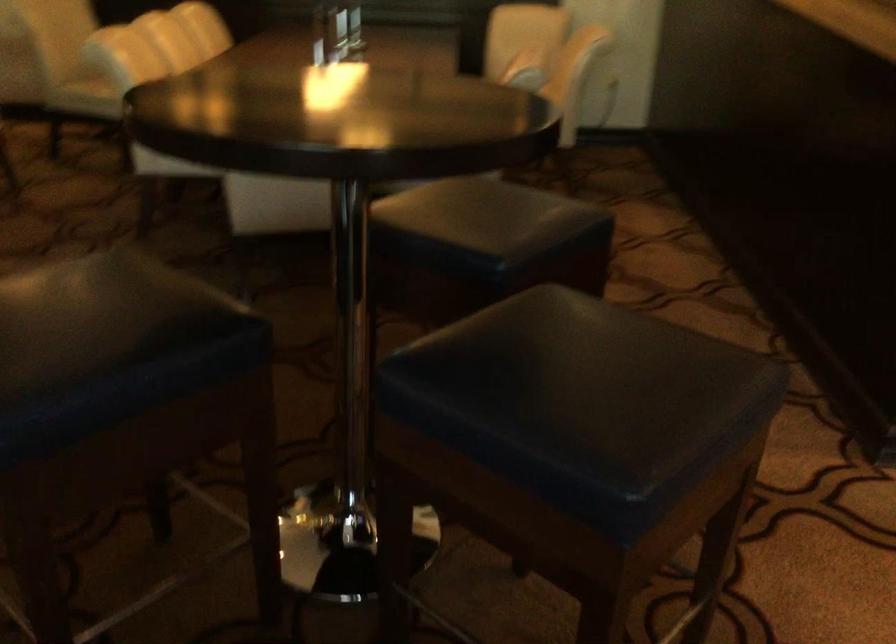
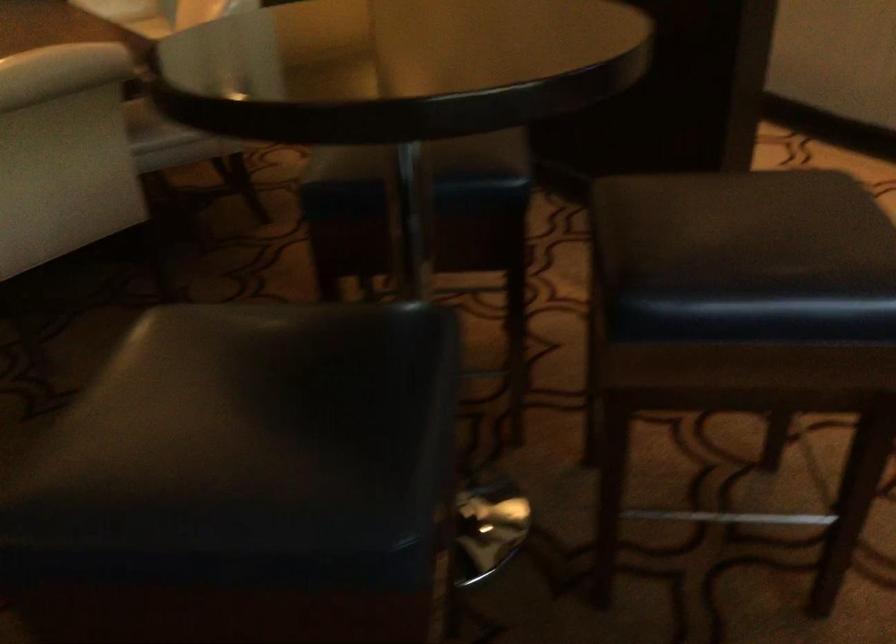
Find the pixel in the second image that matches point (501, 384) in the first image.

(745, 257)